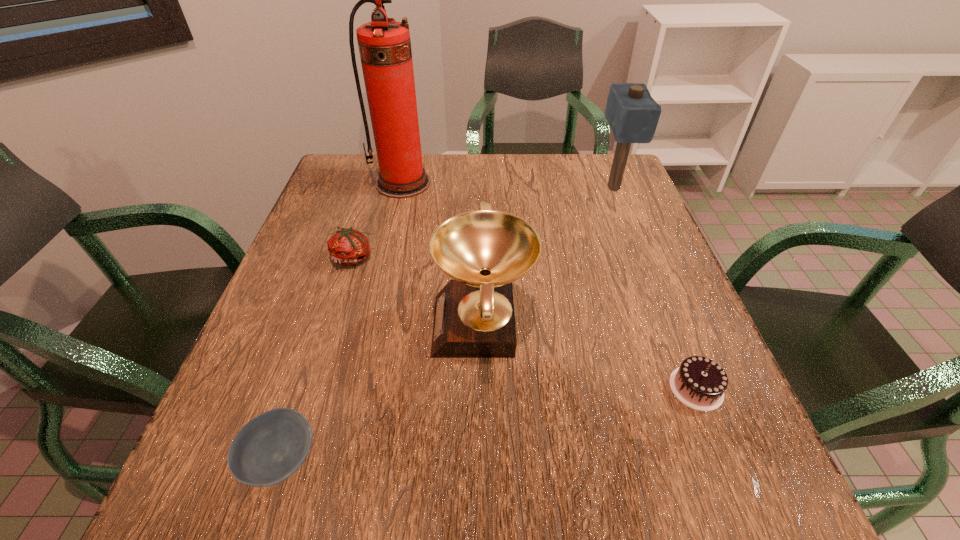
Find the location of a particular element. The width and height of the screenshot is (960, 540). the tallest object is located at coordinates (384, 44).

This screenshot has height=540, width=960. I want to click on mallet, so click(632, 113).

Image resolution: width=960 pixels, height=540 pixels. I want to click on award, so click(483, 251).

The height and width of the screenshot is (540, 960). Identify the location of the fourth object from left to right. (483, 251).

I want to click on the fourth nearest object, so click(348, 246).

The width and height of the screenshot is (960, 540). Find the location of `chocolate cake`. chocolate cake is located at coordinates (699, 383).

This screenshot has height=540, width=960. Identify the location of the shortest object. (267, 450).

This screenshot has height=540, width=960. In order to click on bowl in this screenshot , I will do `click(267, 450)`.

Image resolution: width=960 pixels, height=540 pixels. Find the location of `vacant space located 0.200m at the discharge end of the fire extinguisher`. vacant space located 0.200m at the discharge end of the fire extinguisher is located at coordinates (389, 244).

At what (x,y) coordinates should I click in order to perform the action: click on free location located 0.230m on the front of the mallet. Please return your answer as a coordinate pair (x, y). This screenshot has height=540, width=960. Looking at the image, I should click on (641, 258).